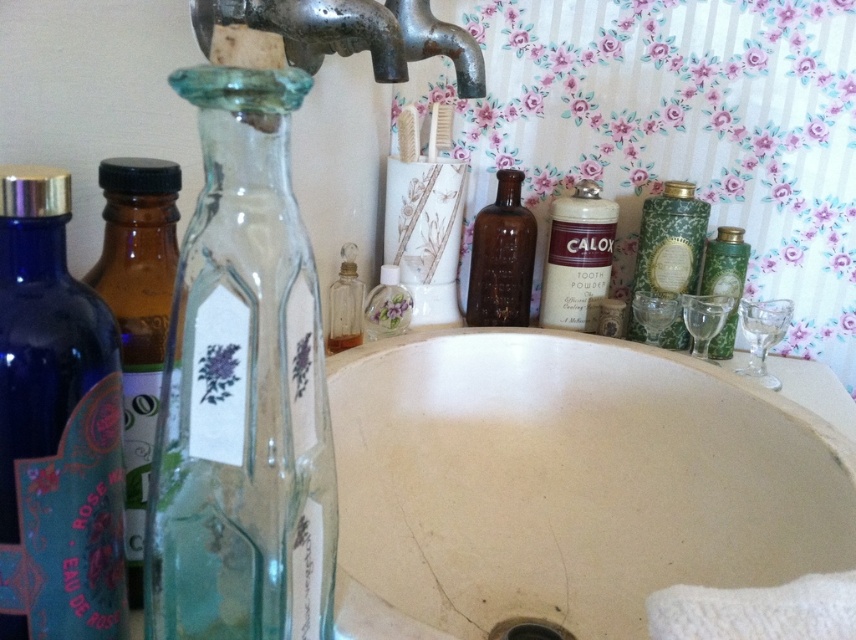
You are a maintenance worker holding a 12 inch wrench. You need to fix the rusty metal faucet at upper center. Can you reach it with your current tool?

The distance between the rusty metal faucet at upper center and the viewer is 10.68 inches. Since the wrench is 12 inches long, it is longer than the required distance, so you can reach the rusty metal faucet at upper center with the wrench.

You are standing in the bathroom and want to reach a specific point to place a small item. The point is located at coordinates point [201,628]. Given that your hand can extend 12 inches forward, will you be able to reach that point?

The distance of point [201,628] from camera is 11.94 inches, so yes, your hand can extend 12 inches forward, which is just enough to reach the point [201,628] as it is slightly closer than the maximum reach.